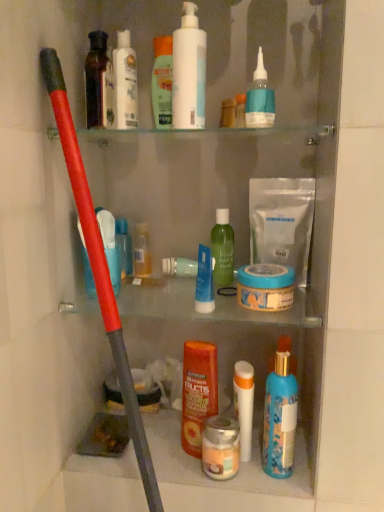
Question: Considering their positions, is white matte tube at center, which ranks as the ninth toiletry in left-to-right order, located in front of or behind translucent plastic bottle at left, marked as the 1th toiletry in a left-to-right arrangement?

Choices:
 (A) front
 (B) behind

Answer: (B)

Question: Is point (236, 374) closer or farther from the camera than point (84, 280)?

Choices:
 (A) closer
 (B) farther

Answer: (A)

Question: Which object is positioned farthest from the translucent plastic bottle at center, arranged as the eighth toiletry when viewed from the right?

Choices:
 (A) white glossy lotion at upper center, which is the 3th toiletry from left to right
 (B) matte black bottle at upper left, the 10th toiletry positioned from the right
 (C) white matte pump bottle at upper center
 (D) blue matte jar at center
 (E) metallic silver jar at center, the 7th toiletry when ordered from left to right

Answer: (E)

Question: Estimate the real-world distances between objects in this image. Which object is closer to the translucent plastic bottle at center, positioned as the 4th toiletry in left-to-right order?

Choices:
 (A) orange glossy shampoo at center, the sixth toiletry viewed from the right
 (B) white matte tube at center, which appears as the third toiletry when viewed from the right
 (C) matte black bottle at upper left, the 10th toiletry positioned from the right
 (D) blue glossy spray bottle at lower center, arranged as the 11th toiletry when viewed from the left
 (E) green matte bottle at center, the 8th toiletry positioned from the left

Answer: (E)